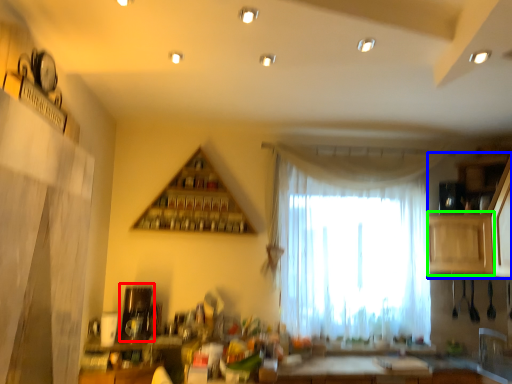
Question: Which is farther away from appliance (highlighted by a red box)? cabinetry (highlighted by a blue box) or cabinetry (highlighted by a green box)?

Choices:
 (A) cabinetry
 (B) cabinetry

Answer: (A)